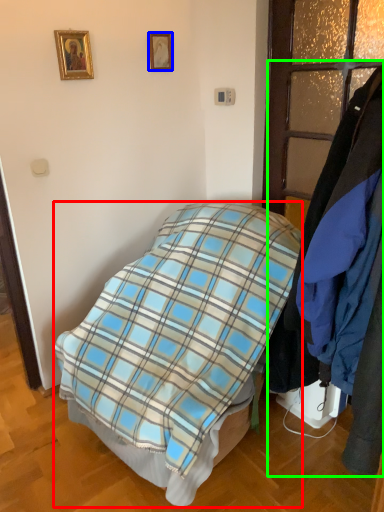
Question: Estimate the real-world distances between objects in this image. Which object is closer to bed (highlighted by a red box), picture frame (highlighted by a blue box) or closet (highlighted by a green box)?

Choices:
 (A) picture frame
 (B) closet

Answer: (B)